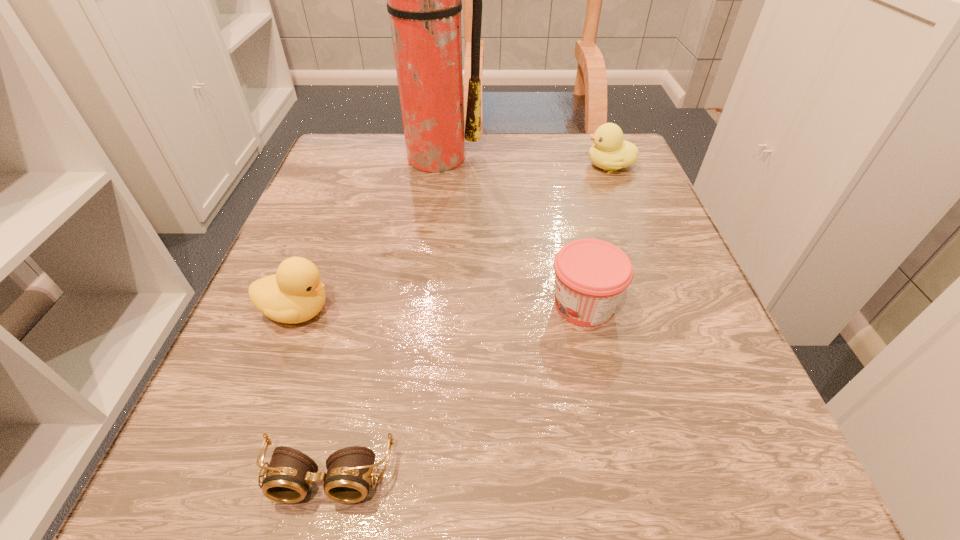
Where is `blank area located at the beak of the duckling`? This screenshot has height=540, width=960. blank area located at the beak of the duckling is located at coordinates (444, 166).

Find the location of a particular element. vacant area situated 0.330m on the front label of the fourth object from left to right is located at coordinates (334, 305).

Find the location of a particular element. vacant region located on the front label of the fourth object from left to right is located at coordinates (289, 305).

I want to click on vacant point located on the front label of the fourth object from left to right, so click(x=477, y=305).

Image resolution: width=960 pixels, height=540 pixels. What are the coordinates of `fire extinguisher located in the far edge section of the desktop` in the screenshot? It's located at (424, 0).

This screenshot has width=960, height=540. I want to click on duckling located in the far edge section of the desktop, so click(610, 152).

Image resolution: width=960 pixels, height=540 pixels. Find the location of `object located in the near edge section of the desktop`. object located in the near edge section of the desktop is located at coordinates (288, 478).

Where is `fire extinguisher situated at the left edge`? The image size is (960, 540). fire extinguisher situated at the left edge is located at coordinates (424, 0).

Locate an element on the screen. duck that is at the left edge is located at coordinates (295, 294).

You are a GUI agent. You are given a task and a screenshot of the screen. Output one action in this format:
    pyautogui.click(x=<x>, y=<y>)
    Task: Click on the goggles present at the left edge
    The width and height of the screenshot is (960, 540).
    Given the screenshot: What is the action you would take?
    pyautogui.click(x=288, y=478)